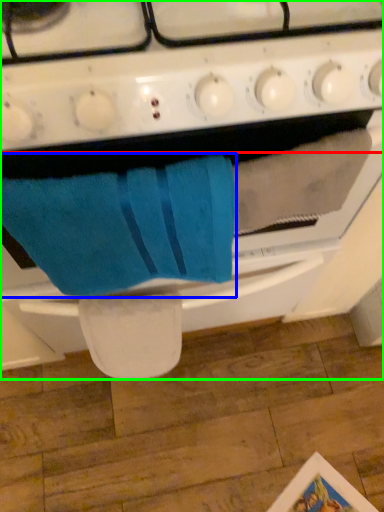
Question: Which is farther away from gas stove (highlighted by a red box)? bath towel (highlighted by a blue box) or oven (highlighted by a green box)?

Choices:
 (A) bath towel
 (B) oven

Answer: (A)